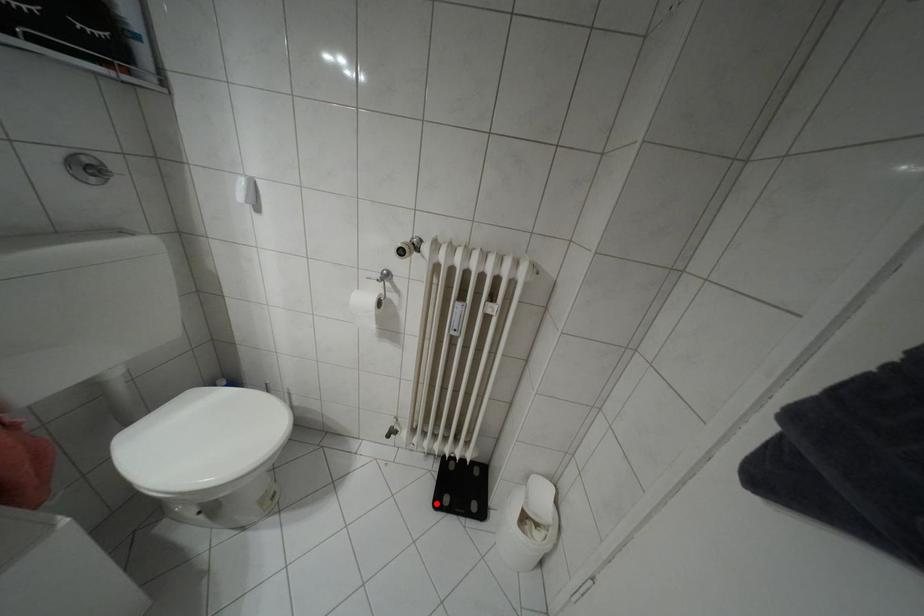
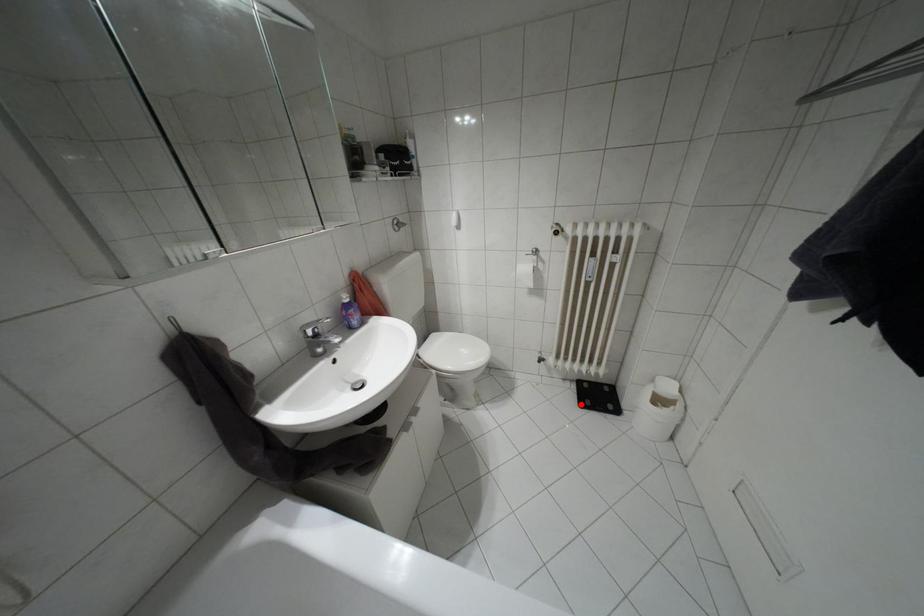
I am providing you with two images of the same scene from different viewpoints. A red point is marked on the first image and another point is marked on the second image. Is the red point in image1 aligned with the point shown in image2?

Yes